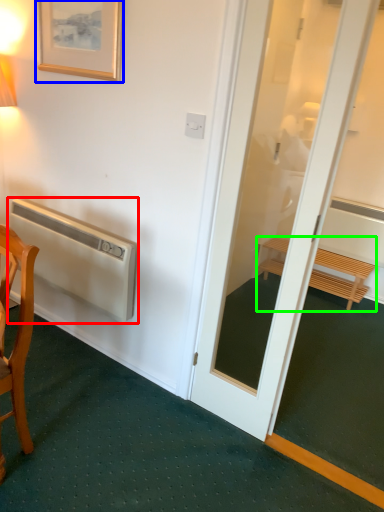
Question: Considering the real-world distances, which object is closest to air conditioner (highlighted by a red box)? picture frame (highlighted by a blue box) or furniture (highlighted by a green box).

Choices:
 (A) picture frame
 (B) furniture

Answer: (A)